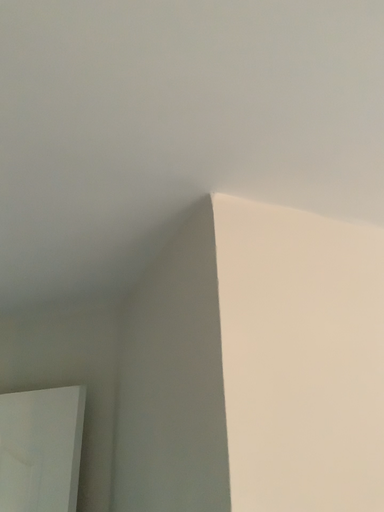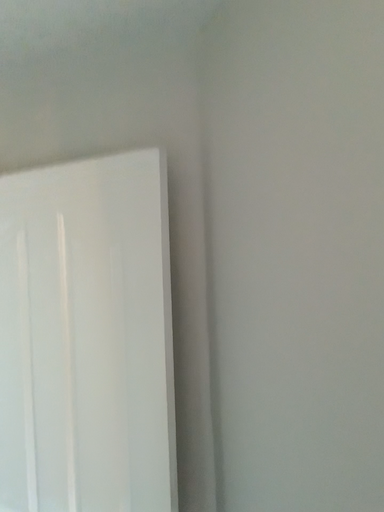
Question: How did the camera likely rotate when shooting the video?

Choices:
 (A) rotated downward
 (B) rotated upward

Answer: (A)